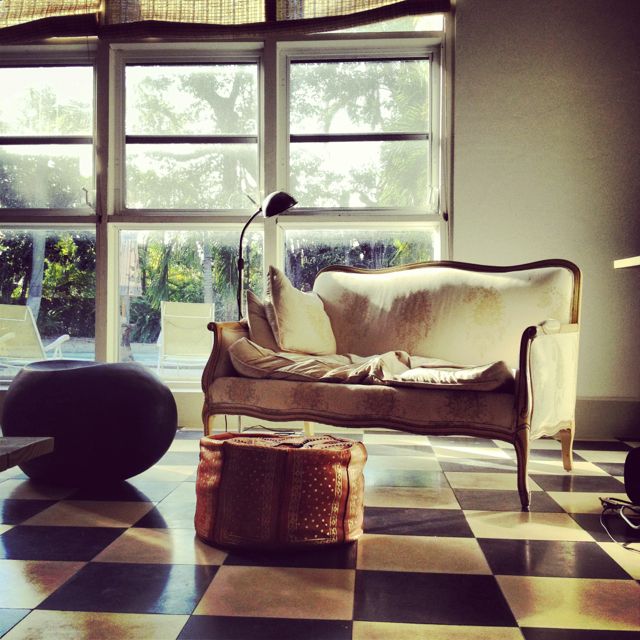
Locate an element on the screen. The image size is (640, 640). couch is located at coordinates (470, 333).